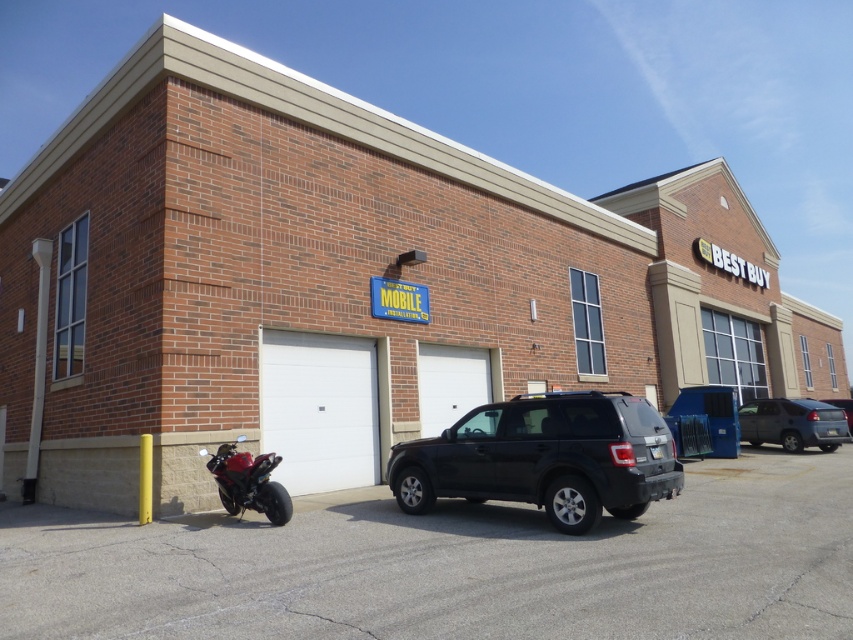
Question: Estimate the real-world distances between objects in this image. Which object is closer to the shiny red motorcycle at lower left?

Choices:
 (A) black matte suv at center
 (B) smooth asphalt parking lot at lower center

Answer: (B)

Question: Does smooth asphalt parking lot at lower center have a greater width compared to shiny red motorcycle at lower left?

Choices:
 (A) no
 (B) yes

Answer: (B)

Question: Does smooth asphalt parking lot at lower center appear on the left side of black matte suv at center?

Choices:
 (A) yes
 (B) no

Answer: (B)

Question: Can you confirm if smooth asphalt parking lot at lower center is thinner than shiny red motorcycle at lower left?

Choices:
 (A) yes
 (B) no

Answer: (B)

Question: Based on their relative distances, which object is nearer to the smooth asphalt parking lot at lower center?

Choices:
 (A) dark gray matte suv at right
 (B) shiny red motorcycle at lower left
 (C) black matte suv at center

Answer: (C)

Question: Which object appears farthest from the camera in this image?

Choices:
 (A) shiny red motorcycle at lower left
 (B) smooth asphalt parking lot at lower center

Answer: (A)